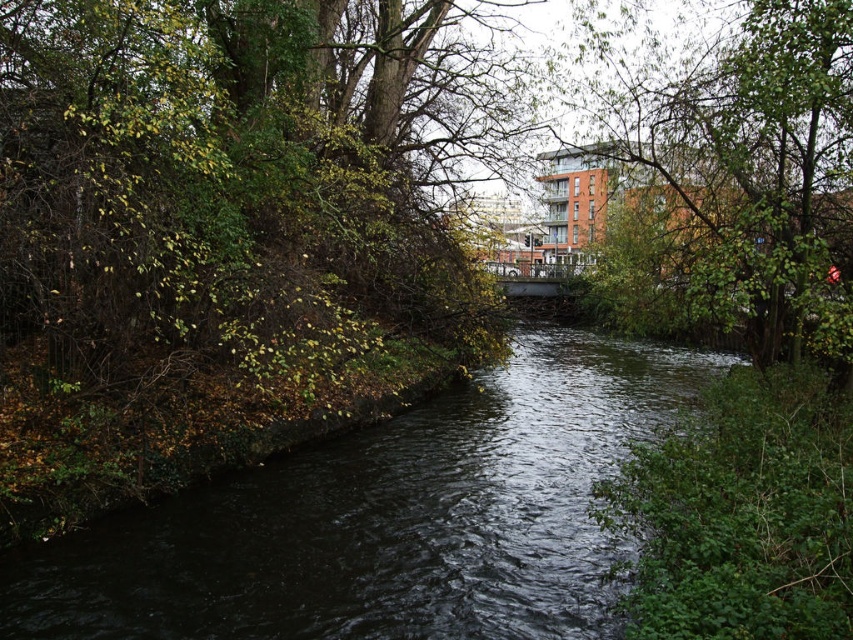
In the scene shown: You are navigating a small boat along the waterway described in the scene. Your GPS indicates the dark water at center is at coordinates point 0.812, 0.454. If you want to dock your boat on the nearest bank, which side should you head towards?

The dark water at center is located at point (386, 518). Since the waterway is narrow and flanked by vegetation on both sides, the nearest bank would depend on the boat position relative to the center. However, the coordinates suggest the center is closer to the right bank, so you should head towards the right side.

You are standing at the edge of the waterway and want to determine which object is taller between the dark water at center and the green leafy tree at upper right. Based on the scene, which one is taller?

The green leafy tree at upper right is taller than the dark water at center.